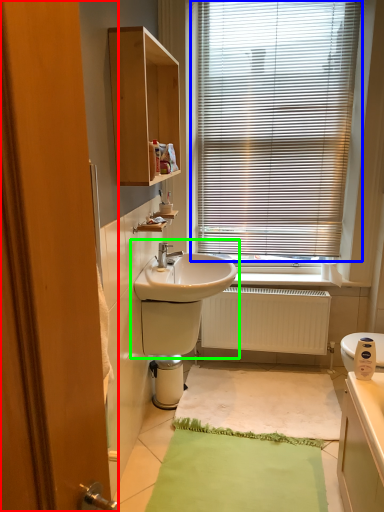
Question: Based on their relative distances, which object is farther from screen door (highlighted by a red box)? Choose from window blind (highlighted by a blue box) and sink (highlighted by a green box).

Choices:
 (A) window blind
 (B) sink

Answer: (A)